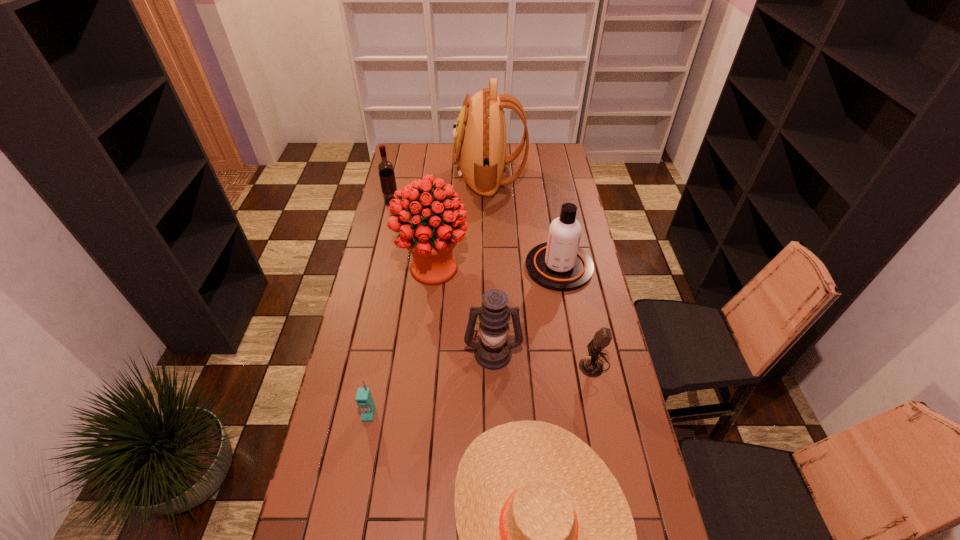
Image resolution: width=960 pixels, height=540 pixels. In order to click on vacant region between the cellular telephone and the bouquet in this screenshot , I will do `click(401, 341)`.

The image size is (960, 540). I want to click on empty location between the microphone and the seventh farthest object, so click(x=482, y=389).

Find the location of a particular element. The height and width of the screenshot is (540, 960). empty space that is in between the oil lamp and the bouquet is located at coordinates click(x=464, y=310).

This screenshot has height=540, width=960. I want to click on empty space between the backpack and the oil lamp, so click(x=491, y=264).

Identify the location of the fifth closest object relative to the seventh shortest object. (591, 366).

Choose which object is the seventh nearest neighbor to the cellular telephone. Please provide its 2D coordinates. Your answer should be formatted as a tuple, i.e. [(x, y)], where the tuple contains the x and y coordinates of a point satisfying the conditions above.

[(479, 152)]

Where is `free location that satisfies the following two spatial constraints: 1. on the front-facing side of the cleansing agent; 2. on the right side of the backpack`? Image resolution: width=960 pixels, height=540 pixels. free location that satisfies the following two spatial constraints: 1. on the front-facing side of the cleansing agent; 2. on the right side of the backpack is located at coordinates (492, 267).